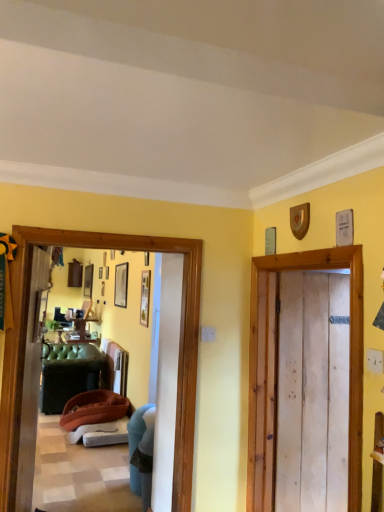
In order to click on empty space that is ontop of natural wood door at right (from a real-world perspective) in this screenshot , I will do `click(302, 273)`.